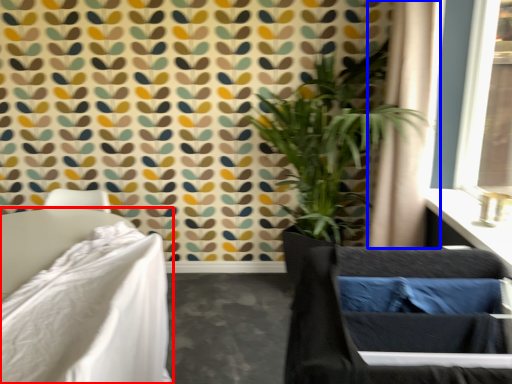
Question: Among these objects, which one is nearest to the camera, furniture (highlighted by a red box) or curtain (highlighted by a blue box)?

Choices:
 (A) furniture
 (B) curtain

Answer: (A)